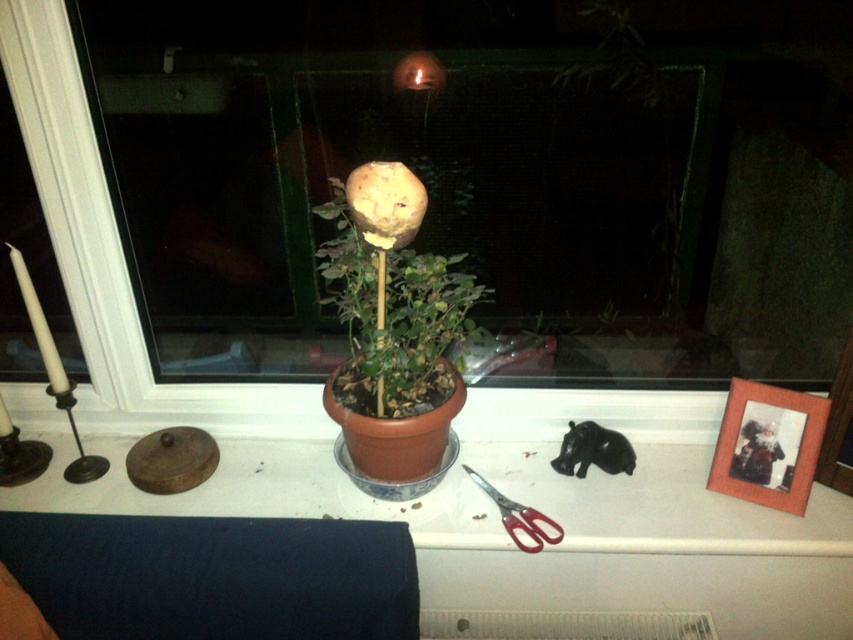
Which is in front, point (402, 276) or point (526, 506)?

Point (402, 276) is more forward.

This screenshot has width=853, height=640. Identify the location of matte brown pot at center. (392, 291).

Who is higher up, transparent glass window at center or red plastic scissors at lower right?

transparent glass window at center is higher up.

Who is lower down, transparent glass window at center or red plastic scissors at lower right?

Positioned lower is red plastic scissors at lower right.

Is point (51, 179) more distant than point (494, 493)?

That is False.

I want to click on transparent glass window at center, so click(x=111, y=253).

Does point (79, 259) come behind point (428, 339)?

Yes.

Who is higher up, transparent glass window at center or matte brown pot at center?

Positioned higher is transparent glass window at center.

Describe the element at coordinates (111, 253) in the screenshot. I see `transparent glass window at center` at that location.

Find the location of `transparent glass window at center`. transparent glass window at center is located at coordinates (111, 253).